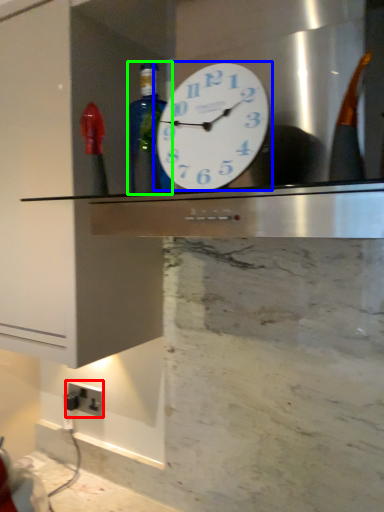
Question: Based on their relative distances, which object is nearer to electric outlet (highlighted by a red box)? Choose from wall clock (highlighted by a blue box) and bottle (highlighted by a green box).

Choices:
 (A) wall clock
 (B) bottle

Answer: (B)